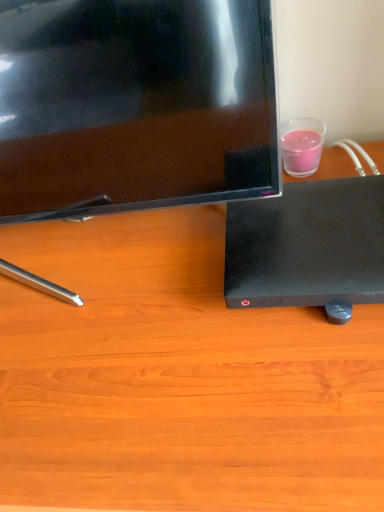
The height and width of the screenshot is (512, 384). Identify the location of black plastic desktop at lower right. (308, 247).

What is the approximate height of black plastic desktop at lower right?

black plastic desktop at lower right is 1.90 inches in height.

What do you see at coordinates (308, 247) in the screenshot? The width and height of the screenshot is (384, 512). I see `black plastic desktop at lower right` at bounding box center [308, 247].

Find the location of a particular element. Image resolution: width=384 pixels, height=512 pixels. black plastic desktop at lower right is located at coordinates (308, 247).